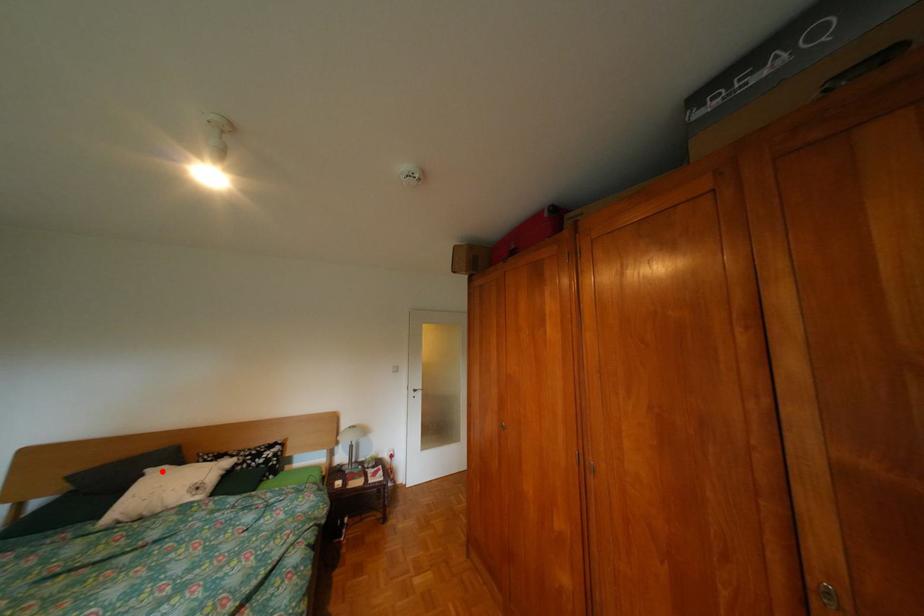
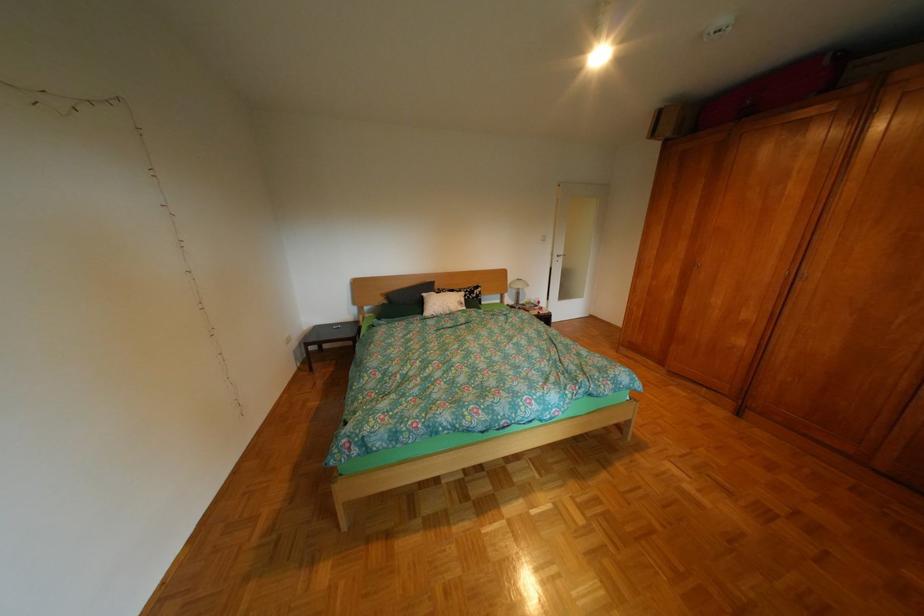
Question: I am providing you with two images of the same scene from different viewpoints. A red point is shown in image1. For the corresponding object point in image2, is it positioned nearer or farther from the camera?

Choices:
 (A) Nearer
 (B) Farther

Answer: (A)